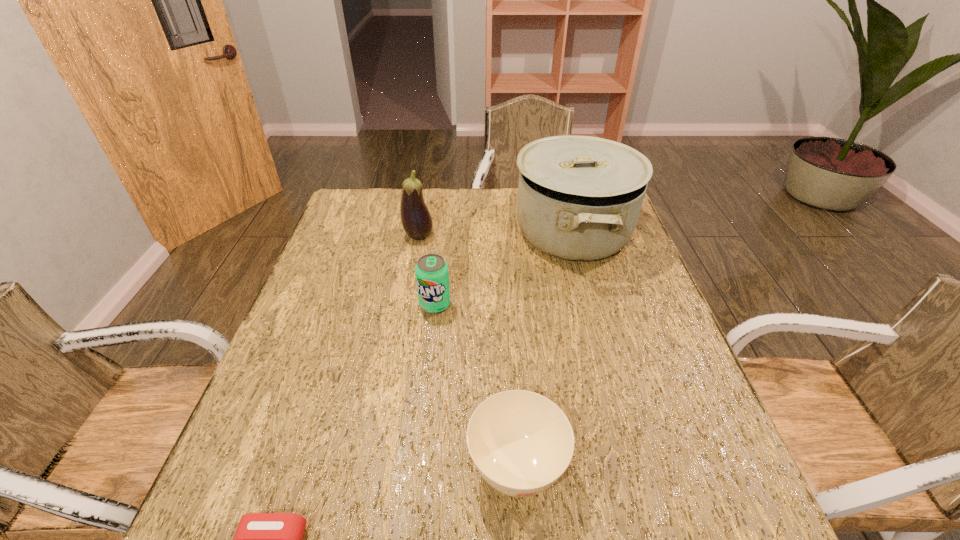
Identify the location of free point between the saucepan and the third nearest object. (503, 268).

Locate an element on the screen. empty location between the third nearest object and the fourth tallest object is located at coordinates pos(476,386).

Identify the location of free space between the pop soda and the fourth farthest object. This screenshot has height=540, width=960. (476, 386).

Find the location of a particular element. object that stands as the fourth closest to the eggplant is located at coordinates (261, 539).

This screenshot has height=540, width=960. Identify the location of object that is the nearest to the third shortest object. (579, 198).

Identify the location of free space that satisfies the following two spatial constraints: 1. on the front side of the fourth farthest object; 2. on the right side of the eggplant. Image resolution: width=960 pixels, height=540 pixels. (377, 467).